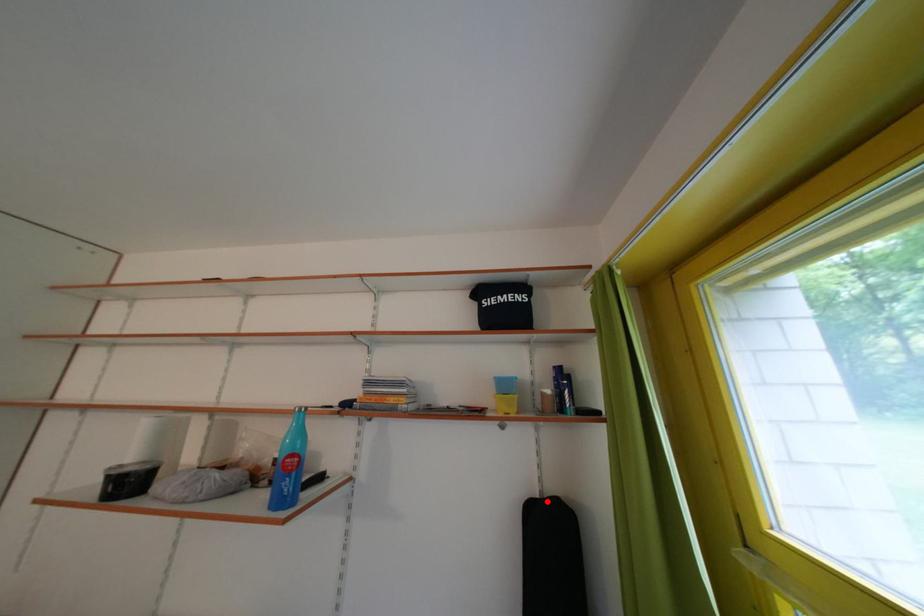
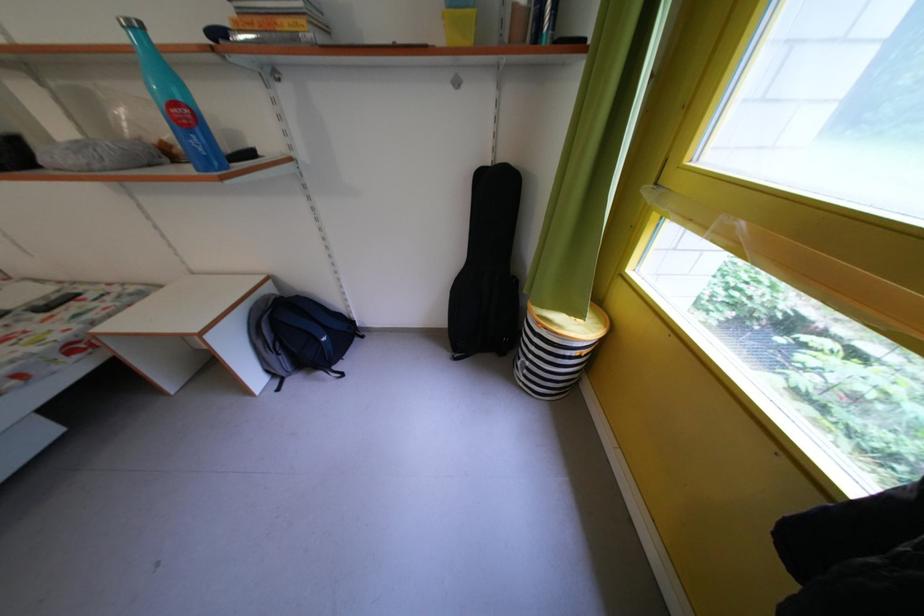
Question: I am providing you with two images of the same scene from different viewpoints. In image1, a red point is highlighted. Considering the same 3D point in image2, which of the following is correct?

Choices:
 (A) It is closer
 (B) It is farther

Answer: (A)